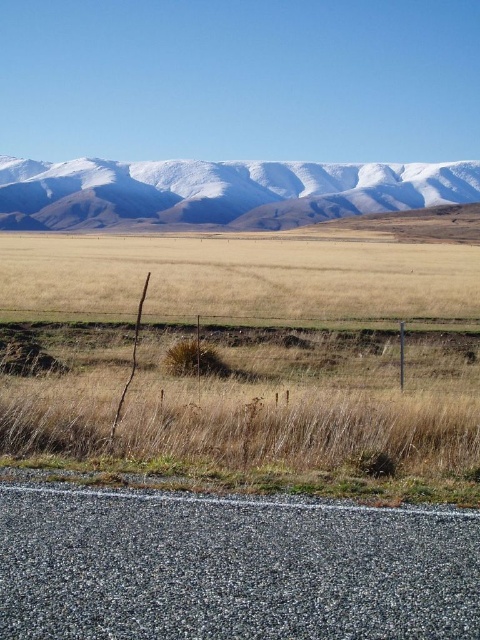
In the scene shown: Can you confirm if white snow-covered mountain range at upper center is smaller than brown wire fence at center?

Actually, white snow-covered mountain range at upper center might be larger than brown wire fence at center.

Does white snow-covered mountain range at upper center appear on the right side of brown wire fence at center?

Correct, you'll find white snow-covered mountain range at upper center to the right of brown wire fence at center.

At what (x,y) coordinates should I click in order to perform the action: click on white snow-covered mountain range at upper center. Please return your answer as a coordinate pair (x, y). This screenshot has height=640, width=480. Looking at the image, I should click on (220, 192).